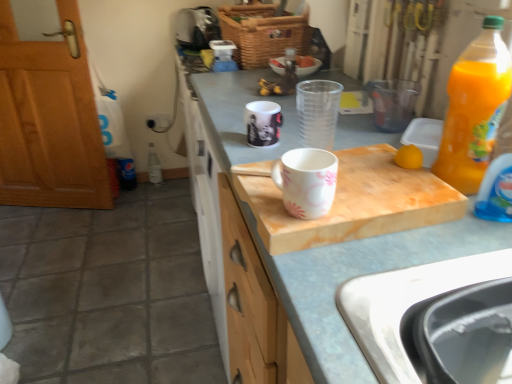
Locate an element on the screen. The image size is (512, 384). vacant space to the right of translucent plastic bottle at center, positioned as the second bottle in bottom-to-top order is located at coordinates (335, 79).